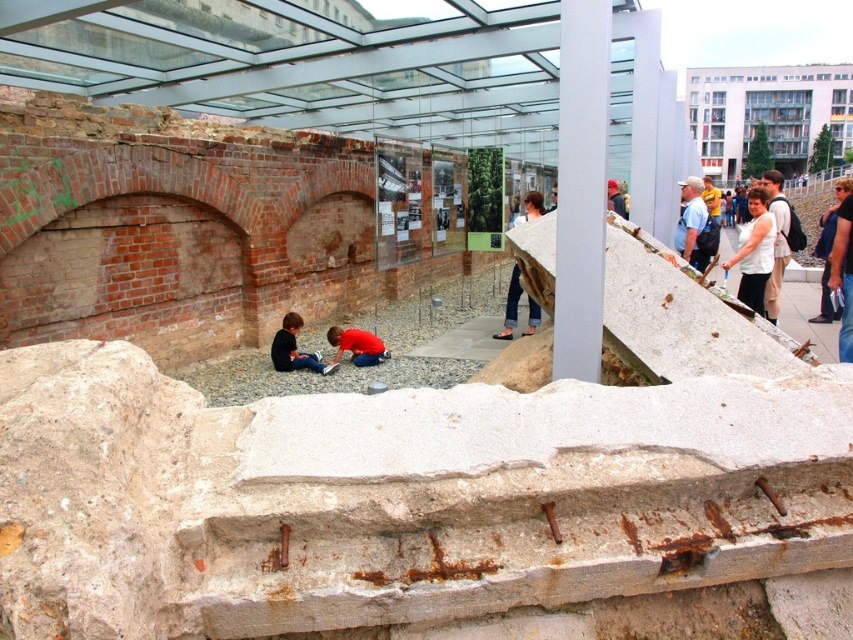
Can you confirm if denim pants at center is thinner than white cotton shirt at center?

Indeed, denim pants at center has a lesser width compared to white cotton shirt at center.

Is the position of denim pants at center less distant than that of white cotton shirt at center?

No, it is not.

Is point (531, 216) closer to viewer compared to point (608, 198)?

Yes, it is in front of point (608, 198).

Find the location of a particular element. Image resolution: width=853 pixels, height=640 pixels. denim pants at center is located at coordinates (509, 305).

Can you confirm if light beige pants at right is positioned to the left of red matte shirt at center?

No, light beige pants at right is not to the left of red matte shirt at center.

Can you confirm if light beige pants at right is bigger than red matte shirt at center?

Yes, light beige pants at right is bigger than red matte shirt at center.

Is point (782, 230) closer to viewer compared to point (366, 355)?

No, it is not.

Image resolution: width=853 pixels, height=640 pixels. I want to click on light beige pants at right, so click(776, 241).

Between white matte shirt at center and white cotton shirt at center, which one has less height?

Standing shorter between the two is white cotton shirt at center.

Is white matte shirt at center thinner than white cotton shirt at center?

In fact, white matte shirt at center might be wider than white cotton shirt at center.

What do you see at coordinates (753, 250) in the screenshot? This screenshot has height=640, width=853. I see `white matte shirt at center` at bounding box center [753, 250].

I want to click on white matte shirt at center, so click(753, 250).